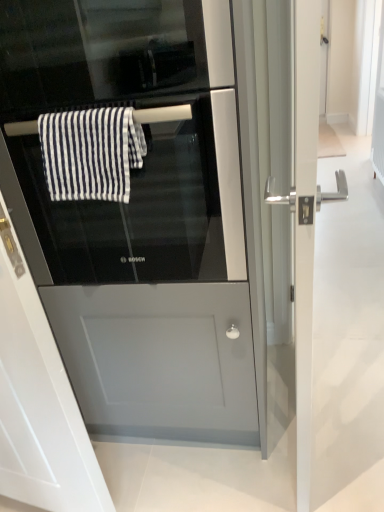
Locate an element on the screen. black glass screen door at center, arranged as the 1th screen door when viewed from the left is located at coordinates (40, 407).

Identify the location of black glass oven at center. (141, 208).

Describe the element at coordinates (141, 208) in the screenshot. I see `black glass oven at center` at that location.

This screenshot has width=384, height=512. Find the location of `silver metallic door handle at right, positioned as the 1th screen door in right-to-left order`. silver metallic door handle at right, positioned as the 1th screen door in right-to-left order is located at coordinates (340, 330).

Based on the photo, considering the relative sizes of white striped fabric at center and black glass oven at center in the image provided, is white striped fabric at center thinner than black glass oven at center?

Yes.

Is white striped fabric at center situated inside black glass oven at center or outside?

white striped fabric at center is located inside black glass oven at center.

From a real-world perspective, who is located higher, white striped fabric at center or black glass oven at center?

In real-world perspective, white striped fabric at center is above.

Locate an element on the screen. The image size is (384, 512). bath towel below the black glass oven at center (from the image's perspective) is located at coordinates (91, 153).

Does point (103, 204) appear closer or farther from the camera than point (181, 312)?

Point (103, 204) appears to be closer to the viewer than point (181, 312).

Locate an element on the screen. oven above the satin silver fridge at center (from the image's perspective) is located at coordinates (141, 208).

Is black glass oven at center located outside satin silver fridge at center?

No, most part of black glass oven at center lies within satin silver fridge at center.

Choose the correct answer: Is white striped fabric at center inside black glass screen door at center, arranged as the 1th screen door when viewed from the left, or outside it?

white striped fabric at center cannot be found inside black glass screen door at center, arranged as the 1th screen door when viewed from the left.

Which is more to the left, white striped fabric at center or black glass screen door at center, arranged as the 1th screen door when viewed from the left?

Positioned to the left is black glass screen door at center, arranged as the 1th screen door when viewed from the left.

Considering the relative sizes of white striped fabric at center and black glass screen door at center, placed as the second screen door when sorted from right to left, in the image provided, is white striped fabric at center taller than black glass screen door at center, placed as the second screen door when sorted from right to left,?

No.

Is there a large distance between white striped fabric at center and black glass screen door at center, placed as the second screen door when sorted from right to left?

white striped fabric at center is actually quite close to black glass screen door at center, placed as the second screen door when sorted from right to left.

Would you say white striped fabric at center is part of black glass oven at center's contents?

Indeed, white striped fabric at center is located within black glass oven at center.

Consider the image. Which of these two, black glass oven at center or white striped fabric at center, stands taller?

With more height is black glass oven at center.

Considering their positions, is black glass oven at center located in front of or behind white striped fabric at center?

Visually, black glass oven at center is located in front of white striped fabric at center.

Between black glass oven at center and black glass screen door at center, arranged as the 1th screen door when viewed from the left, which one appears on the left side from the viewer's perspective?

From the viewer's perspective, black glass screen door at center, arranged as the 1th screen door when viewed from the left, appears more on the left side.

Is black glass oven at center taller than black glass screen door at center, placed as the second screen door when sorted from right to left?

Incorrect, the height of black glass oven at center is not larger of that of black glass screen door at center, placed as the second screen door when sorted from right to left.

Is black glass oven at center turned away from black glass screen door at center, arranged as the 1th screen door when viewed from the left?

No, black glass oven at center is not facing the opposite direction of black glass screen door at center, arranged as the 1th screen door when viewed from the left.

From the image's perspective, starting from the black glass oven at center, which screen door is the 2nd one below? Please provide its 2D coordinates.

[(40, 407)]

From a real-world perspective, between black glass screen door at center, placed as the second screen door when sorted from right to left, and black glass oven at center, who is vertically lower?

From a 3D spatial view, black glass screen door at center, placed as the second screen door when sorted from right to left, is below.

Considering the points (45, 345) and (126, 215), which point is behind, point (45, 345) or point (126, 215)?

The point (126, 215) is more distant.

In terms of width, does black glass screen door at center, arranged as the 1th screen door when viewed from the left, look wider or thinner when compared to black glass oven at center?

black glass screen door at center, arranged as the 1th screen door when viewed from the left, is thinner than black glass oven at center.

From the picture: Does black glass screen door at center, arranged as the 1th screen door when viewed from the left, touch white striped fabric at center?

No, black glass screen door at center, arranged as the 1th screen door when viewed from the left, is not with white striped fabric at center.

Is black glass screen door at center, placed as the second screen door when sorted from right to left, facing away from white striped fabric at center?

Yes, black glass screen door at center, placed as the second screen door when sorted from right to left, is facing away from white striped fabric at center.

Choose the correct answer: Is black glass screen door at center, arranged as the 1th screen door when viewed from the left, inside white striped fabric at center or outside it?

black glass screen door at center, arranged as the 1th screen door when viewed from the left, lies outside white striped fabric at center.

Locate an element on the screen. The image size is (384, 512). oven on the right side of white striped fabric at center is located at coordinates (141, 208).

Image resolution: width=384 pixels, height=512 pixels. In order to click on fridge in front of the black glass oven at center in this screenshot , I will do `click(137, 212)`.

From the image, which object appears to be farther from white striped fabric at center, black glass screen door at center, placed as the second screen door when sorted from right to left, or silver metallic door handle at right, marked as the 2th screen door in a left-to-right arrangement?

silver metallic door handle at right, marked as the 2th screen door in a left-to-right arrangement, lies further to white striped fabric at center than the other object.

Estimate the real-world distances between objects in this image. Which object is further from black glass oven at center, black glass screen door at center, arranged as the 1th screen door when viewed from the left, or silver metallic door handle at right, positioned as the 1th screen door in right-to-left order?

Among the two, silver metallic door handle at right, positioned as the 1th screen door in right-to-left order, is located further to black glass oven at center.

Which object lies further to the anchor point silver metallic door handle at right, marked as the 2th screen door in a left-to-right arrangement, satin silver fridge at center or white striped fabric at center?

white striped fabric at center lies further to silver metallic door handle at right, marked as the 2th screen door in a left-to-right arrangement, than the other object.

Based on their spatial positions, is black glass oven at center or black glass screen door at center, arranged as the 1th screen door when viewed from the left, closer to silver metallic door handle at right, positioned as the 1th screen door in right-to-left order?

Among the two, black glass oven at center is located nearer to silver metallic door handle at right, positioned as the 1th screen door in right-to-left order.

When comparing their distances from silver metallic door handle at right, marked as the 2th screen door in a left-to-right arrangement, does white striped fabric at center or satin silver fridge at center seem further?

Among the two, white striped fabric at center is located further to silver metallic door handle at right, marked as the 2th screen door in a left-to-right arrangement.

From the image, which object appears to be nearer to silver metallic door handle at right, positioned as the 1th screen door in right-to-left order, satin silver fridge at center or black glass screen door at center, arranged as the 1th screen door when viewed from the left?

satin silver fridge at center is positioned closer to the anchor silver metallic door handle at right, positioned as the 1th screen door in right-to-left order.

Looking at the image, which one is located closer to satin silver fridge at center, black glass oven at center or white striped fabric at center?

black glass oven at center is positioned closer to the anchor satin silver fridge at center.

Looking at this image, considering their positions, is black glass oven at center positioned further to satin silver fridge at center than black glass screen door at center, arranged as the 1th screen door when viewed from the left?

black glass screen door at center, arranged as the 1th screen door when viewed from the left, is positioned further to the anchor satin silver fridge at center.

You are a GUI agent. You are given a task and a screenshot of the screen. Output one action in this format:
    pyautogui.click(x=<x>, y=<y>)
    Task: Click on the fridge between black glass screen door at center, arranged as the 1th screen door when viewed from the left, and silver metallic door handle at right, marked as the 2th screen door in a left-to-right arrangement, from left to right
    The width and height of the screenshot is (384, 512).
    Given the screenshot: What is the action you would take?
    pyautogui.click(x=137, y=212)

This screenshot has width=384, height=512. What are the coordinates of `oven between white striped fabric at center and silver metallic door handle at right, positioned as the 1th screen door in right-to-left order, from left to right` in the screenshot? It's located at (141, 208).

Identify the location of bath towel located between black glass screen door at center, placed as the second screen door when sorted from right to left, and silver metallic door handle at right, positioned as the 1th screen door in right-to-left order, in the left-right direction. (91, 153).

What are the coordinates of `fridge between black glass oven at center and black glass screen door at center, arranged as the 1th screen door when viewed from the left, in the up-down direction` in the screenshot? It's located at 137,212.